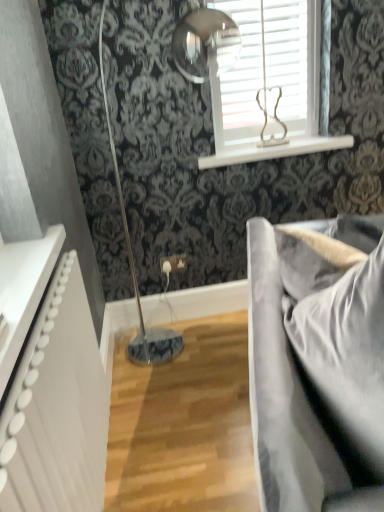
You are a GUI agent. You are given a task and a screenshot of the screen. Output one action in this format:
    pyautogui.click(x=<x>, y=<y>)
    Task: Click on the satin grey fabric couch at right
    The height and width of the screenshot is (512, 384).
    Given the screenshot: What is the action you would take?
    pyautogui.click(x=314, y=359)

What is the approximate height of white textured radiator at left?

The height of white textured radiator at left is 27.47 inches.

The width and height of the screenshot is (384, 512). I want to click on satin grey fabric couch at right, so click(314, 359).

Can you confirm if white textured radiator at left is bigger than satin grey fabric couch at right?

Actually, white textured radiator at left might be smaller than satin grey fabric couch at right.

From a real-world perspective, is white textured radiator at left physically located above or below satin grey fabric couch at right?

In terms of real-world spatial position, white textured radiator at left is above satin grey fabric couch at right.

Is white textured radiator at left positioned in front of satin grey fabric couch at right?

That is False.

Is point (82, 387) behind point (254, 434)?

That is True.

From a real-world perspective, which object stands above the other?

white wooden blinds at upper center, from a real-world perspective.

In the scene shown: Considering the relative positions of satin grey fabric couch at right and white wooden blinds at upper center in the image provided, is satin grey fabric couch at right to the left or to the right of white wooden blinds at upper center?

Clearly, satin grey fabric couch at right is on the right of white wooden blinds at upper center in the image.

Would you say satin grey fabric couch at right contains white wooden blinds at upper center?

No, white wooden blinds at upper center is not surrounded by satin grey fabric couch at right.

Is satin grey fabric couch at right not close to white wooden blinds at upper center?

Yes, satin grey fabric couch at right is far from white wooden blinds at upper center.

Can you confirm if satin grey fabric couch at right is positioned to the left of white textured radiator at left?

Incorrect, satin grey fabric couch at right is not on the left side of white textured radiator at left.

The width and height of the screenshot is (384, 512). Identify the location of radiator that is above the satin grey fabric couch at right (from a real-world perspective). (58, 406).

Is satin grey fabric couch at right oriented away from white textured radiator at left?

Correct, satin grey fabric couch at right is looking away from white textured radiator at left.

Is satin grey fabric couch at right closer to the viewer compared to white textured radiator at left?

Yes, it is.

Is point (97, 453) positioned after point (238, 151)?

No, it is not.

Could you tell me if white textured radiator at left is turned towards white glossy window sill at upper center?

No.

Which of these two, white textured radiator at left or white glossy window sill at upper center, is bigger?

white textured radiator at left.

Is white glossy window sill at upper center turned away from white textured radiator at left?

That's not correct — white glossy window sill at upper center is not looking away from white textured radiator at left.

Choose the correct answer: Is white glossy window sill at upper center inside white textured radiator at left or outside it?

white glossy window sill at upper center cannot be found inside white textured radiator at left.

Consider the image. Is white glossy window sill at upper center far from white textured radiator at left?

Yes, white glossy window sill at upper center and white textured radiator at left are quite far apart.

Does white textured radiator at left turn towards white wooden blinds at upper center?

No, white textured radiator at left is not turned towards white wooden blinds at upper center.

From a real-world perspective, which is physically below, white textured radiator at left or white wooden blinds at upper center?

white textured radiator at left, from a real-world perspective.

From their relative heights in the image, would you say white textured radiator at left is taller or shorter than white wooden blinds at upper center?

white textured radiator at left is taller than white wooden blinds at upper center.

Is white textured radiator at left not close to white wooden blinds at upper center?

Yes, white textured radiator at left is far from white wooden blinds at upper center.

Are satin grey fabric couch at right and white glossy window sill at upper center far apart?

Yes.

From a real-world perspective, does satin grey fabric couch at right stand above white glossy window sill at upper center?

Actually, satin grey fabric couch at right is physically below white glossy window sill at upper center in the real world.

Looking at their sizes, would you say satin grey fabric couch at right is wider or thinner than white glossy window sill at upper center?

satin grey fabric couch at right is wider than white glossy window sill at upper center.

Does satin grey fabric couch at right come behind white glossy window sill at upper center?

No, satin grey fabric couch at right is closer to the camera.

Locate an element on the screen. Image resolution: width=384 pixels, height=512 pixels. studio couch lying on the right of white textured radiator at left is located at coordinates (314, 359).

Image resolution: width=384 pixels, height=512 pixels. I want to click on window located on the left of satin grey fabric couch at right, so click(268, 73).

From the image, which object appears to be nearer to white textured radiator at left, satin grey fabric couch at right or white glossy window sill at upper center?

satin grey fabric couch at right.

Which object lies nearer to the anchor point white glossy window sill at upper center, white wooden blinds at upper center or satin grey fabric couch at right?

Among the two, white wooden blinds at upper center is located nearer to white glossy window sill at upper center.

From the image, which object appears to be nearer to satin grey fabric couch at right, white glossy window sill at upper center or white wooden blinds at upper center?

white wooden blinds at upper center is positioned closer to the anchor satin grey fabric couch at right.

Looking at the image, which one is located closer to satin grey fabric couch at right, white wooden blinds at upper center or white glossy window sill at upper center?

white wooden blinds at upper center is closer to satin grey fabric couch at right.

Which object lies nearer to the anchor point white wooden blinds at upper center, satin grey fabric couch at right or white glossy window sill at upper center?

white glossy window sill at upper center lies closer to white wooden blinds at upper center than the other object.

Looking at the image, which one is located further to satin grey fabric couch at right, white textured radiator at left or white glossy window sill at upper center?

Among the two, white glossy window sill at upper center is located further to satin grey fabric couch at right.

Based on their spatial positions, is white wooden blinds at upper center or white textured radiator at left closer to white glossy window sill at upper center?

The object closer to white glossy window sill at upper center is white wooden blinds at upper center.

From the image, which object appears to be nearer to white wooden blinds at upper center, satin grey fabric couch at right or white textured radiator at left?

satin grey fabric couch at right is closer to white wooden blinds at upper center.

Locate an element on the screen. radiator between satin grey fabric couch at right and white wooden blinds at upper center along the z-axis is located at coordinates (58, 406).

The width and height of the screenshot is (384, 512). I want to click on window positioned between white textured radiator at left and white glossy window sill at upper center from near to far, so click(x=268, y=73).

The image size is (384, 512). In order to click on radiator positioned between satin grey fabric couch at right and white glossy window sill at upper center from near to far in this screenshot , I will do `click(58, 406)`.

This screenshot has height=512, width=384. I want to click on window positioned between satin grey fabric couch at right and white glossy window sill at upper center from near to far, so click(268, 73).